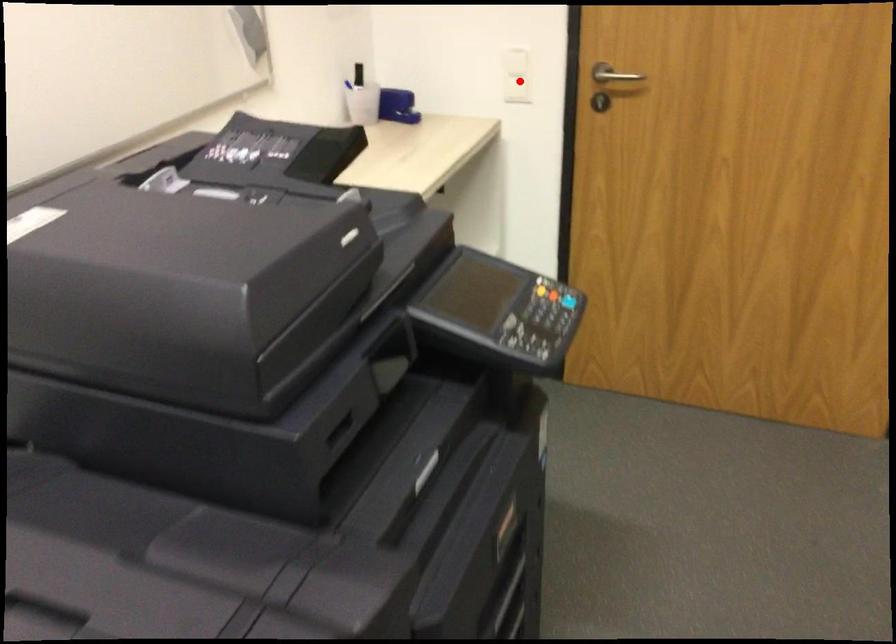
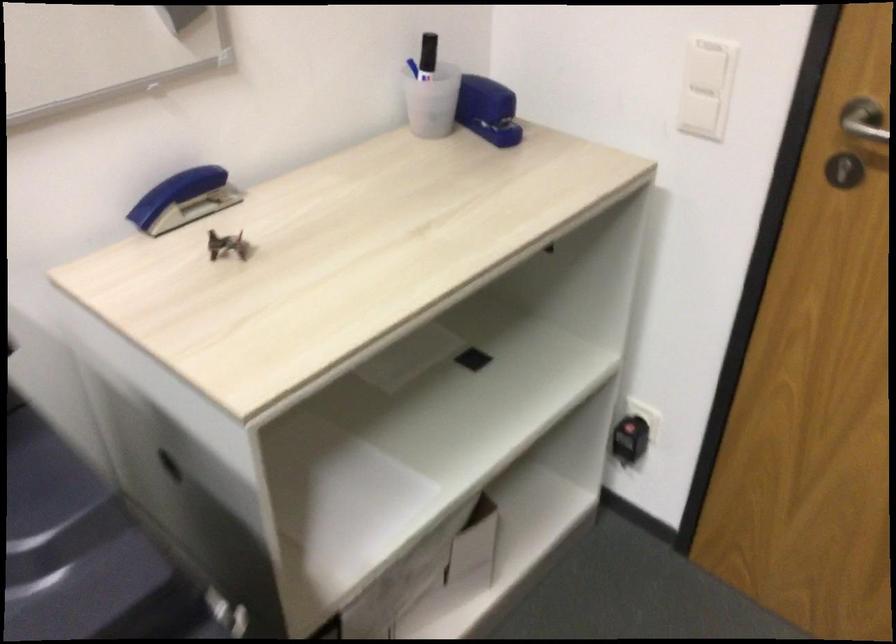
Locate, in the second image, the point that corresponds to the highlighted location in the first image.

(696, 99)